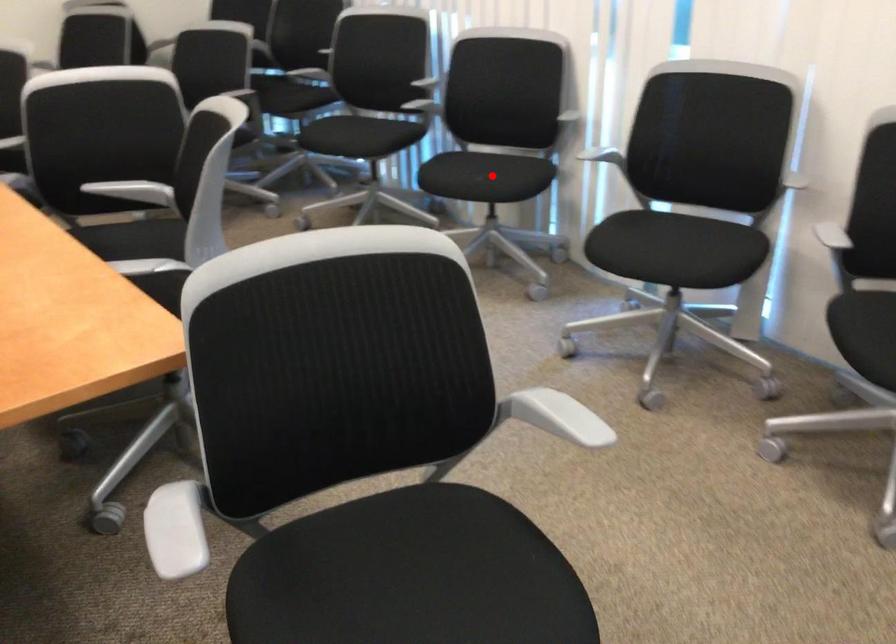
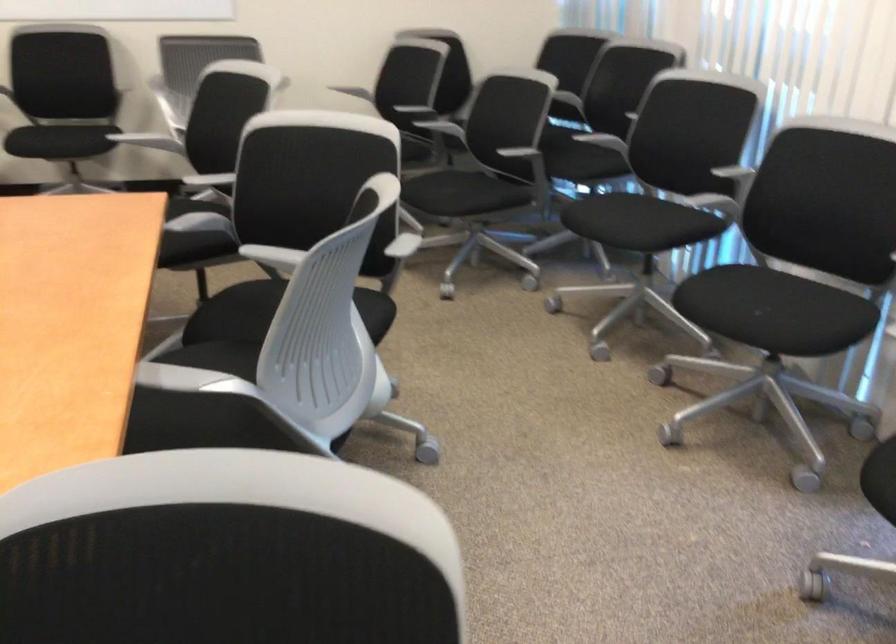
Where in the second image is the point corresponding to the highlighted location from the first image?

(771, 310)